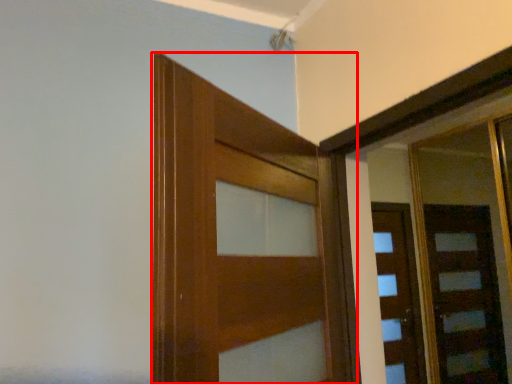
Question: Considering the relative positions of door (annotated by the red box) and door in the image provided, where is door (annotated by the red box) located with respect to the staircase?

Choices:
 (A) right
 (B) left

Answer: (B)